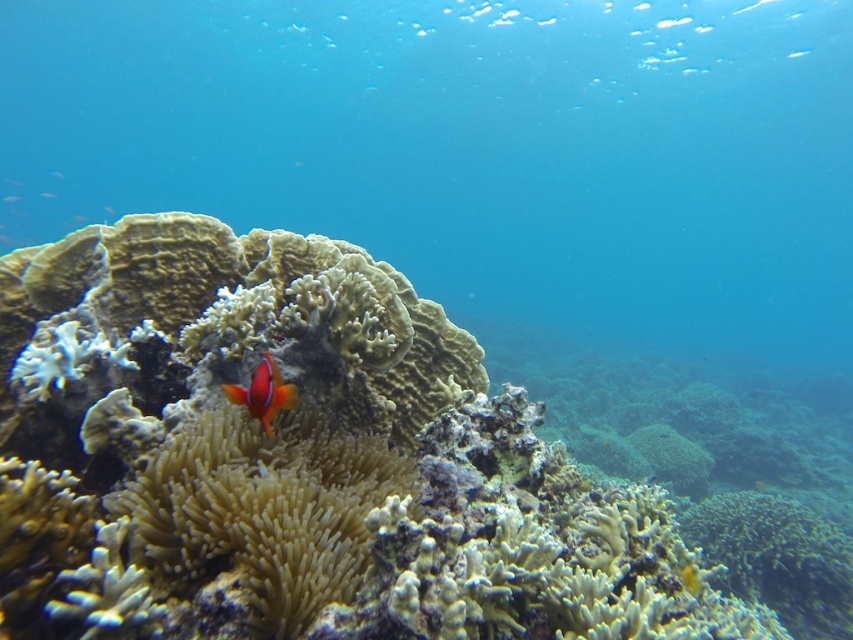
Describe the element at coordinates (263, 394) in the screenshot. This screenshot has height=640, width=853. I see `shiny orange clownfish at center` at that location.

Is point (286, 401) in front of point (692, 572)?

That is True.

Identify the location of shiny orange clownfish at center. (263, 394).

Who is shorter, smooth coral reef at center or shiny yellow fish at center?

shiny yellow fish at center

Does smooth coral reef at center come behind shiny yellow fish at center?

That is False.

Does point (144, 252) come closer to viewer compared to point (695, 570)?

That is False.

Locate an element on the screen. Image resolution: width=853 pixels, height=640 pixels. smooth coral reef at center is located at coordinates (299, 461).

Is smooth coral reef at center smaller than translucent white anemone at center?

No.

Does smooth coral reef at center have a greater width compared to translucent white anemone at center?

Yes, smooth coral reef at center is wider than translucent white anemone at center.

Where is `smooth coral reef at center`? This screenshot has height=640, width=853. smooth coral reef at center is located at coordinates (299, 461).